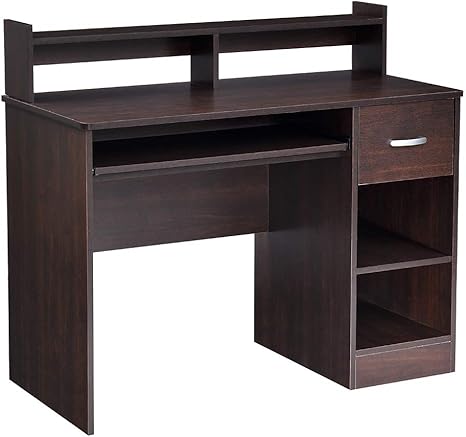
I want to click on small shelf on desk, so click(x=23, y=60), click(x=214, y=51), click(x=371, y=42).